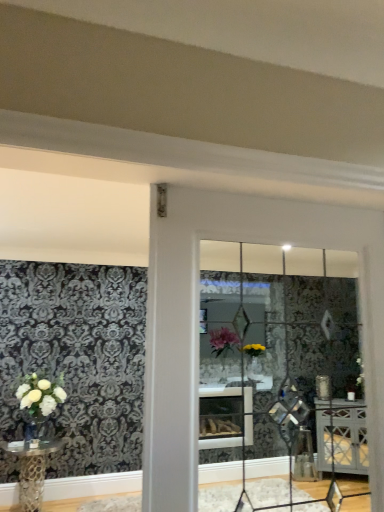
Question: From the image's perspective, is metallic gold table at lower left on top of clear glass door at center?

Choices:
 (A) yes
 (B) no

Answer: (B)

Question: Is metallic gold table at lower left positioned with its back to clear glass door at center?

Choices:
 (A) no
 (B) yes

Answer: (A)

Question: Would you say metallic gold table at lower left is outside clear glass door at center?

Choices:
 (A) yes
 (B) no

Answer: (A)

Question: Is clear glass door at center surrounded by metallic gold table at lower left?

Choices:
 (A) no
 (B) yes

Answer: (A)

Question: Can you confirm if metallic gold table at lower left is thinner than clear glass door at center?

Choices:
 (A) yes
 (B) no

Answer: (B)

Question: Does point (31, 439) appear closer or farther from the camera than point (39, 395)?

Choices:
 (A) farther
 (B) closer

Answer: (B)

Question: Choose the correct answer: Is clear glass vase at lower left inside white matte vase at left or outside it?

Choices:
 (A) inside
 (B) outside

Answer: (A)

Question: From a real-world perspective, is clear glass vase at lower left positioned above or below white matte vase at left?

Choices:
 (A) below
 (B) above

Answer: (A)

Question: Considering the positions of clear glass vase at lower left and white matte vase at left in the image, is clear glass vase at lower left bigger or smaller than white matte vase at left?

Choices:
 (A) big
 (B) small

Answer: (B)

Question: Based on their positions, is clear glass door at center located to the left or right of metallic gold table at lower left?

Choices:
 (A) left
 (B) right

Answer: (B)

Question: Is clear glass door at center taller or shorter than metallic gold table at lower left?

Choices:
 (A) tall
 (B) short

Answer: (A)

Question: From a real-world perspective, relative to metallic gold table at lower left, is clear glass door at center vertically above or below?

Choices:
 (A) below
 (B) above

Answer: (B)

Question: Looking at the image, does clear glass door at center seem bigger or smaller compared to metallic gold table at lower left?

Choices:
 (A) big
 (B) small

Answer: (B)

Question: Is white matte vase at left inside or outside of metallic gold table at lower left?

Choices:
 (A) inside
 (B) outside

Answer: (B)

Question: From a real-world perspective, is white matte vase at left above or below metallic gold table at lower left?

Choices:
 (A) above
 (B) below

Answer: (A)